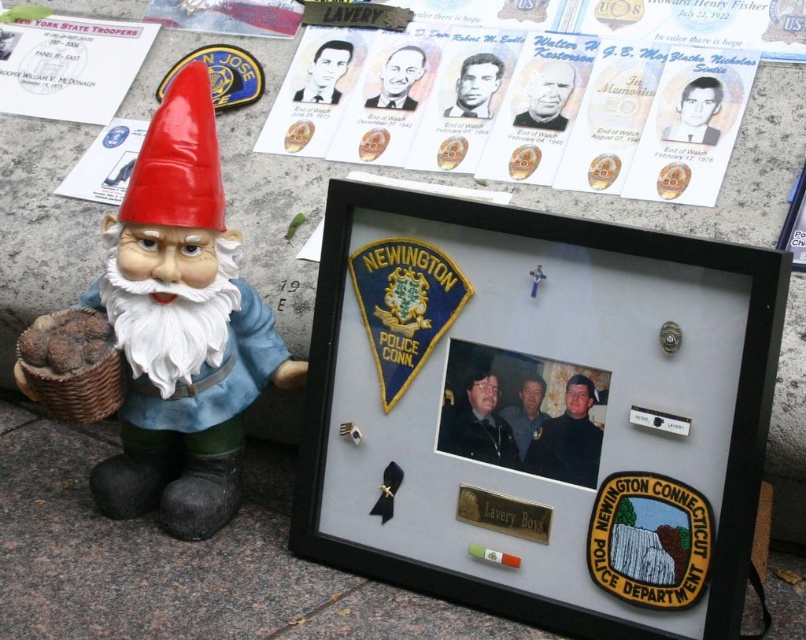
Can you confirm if matte black shadowbox at center is positioned above metallic silver plaque at center?

Yes, matte black shadowbox at center is above metallic silver plaque at center.

Does point (352, 362) come closer to viewer compared to point (493, 500)?

No.

The image size is (806, 640). Describe the element at coordinates (538, 410) in the screenshot. I see `matte black shadowbox at center` at that location.

Identify the location of matte black shadowbox at center. (538, 410).

Is matte black shadowbox at center to the right of matte paper portraits at upper center from the viewer's perspective?

Incorrect, matte black shadowbox at center is not on the right side of matte paper portraits at upper center.

Which is below, matte black shadowbox at center or matte paper portraits at upper center?

matte black shadowbox at center

What do you see at coordinates (538, 410) in the screenshot?
I see `matte black shadowbox at center` at bounding box center [538, 410].

Locate an element on the screen. The height and width of the screenshot is (640, 806). matte black shadowbox at center is located at coordinates (538, 410).

Does matte plastic gnome at left appear under metallic silver plaque at center?

No.

Who is higher up, matte plastic gnome at left or metallic silver plaque at center?

matte plastic gnome at left is above.

Which is in front, point (190, 256) or point (485, 515)?

Point (485, 515) is in front.

Where is `matte plastic gnome at left`? Image resolution: width=806 pixels, height=640 pixels. matte plastic gnome at left is located at coordinates (181, 326).